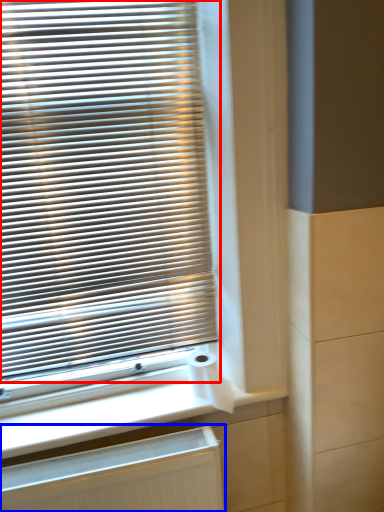
Question: Which object is further to the camera taking this photo, window blind (highlighted by a red box) or radiator (highlighted by a blue box)?

Choices:
 (A) window blind
 (B) radiator

Answer: (B)